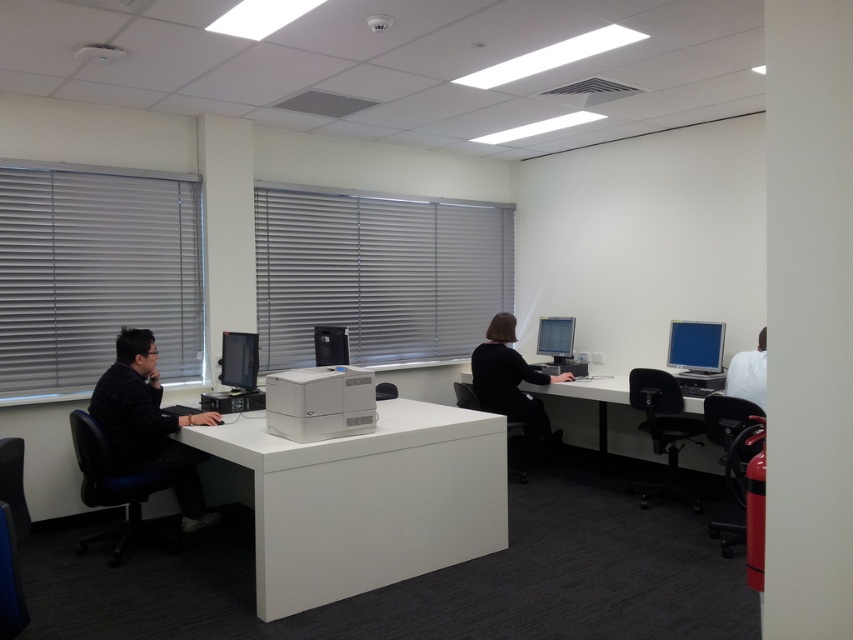
You are an office worker who needs to place a 15 cm tall box on either the white glossy table at center or the white plastic monitor at center. Based on their heights, which surface can safely accommodate the box without exceeding its height?

The white glossy table at center is taller than the white plastic monitor at center, so placing the 15 cm tall box on the white glossy table at center would be safe as it can accommodate the height, whereas the monitor might be too short.